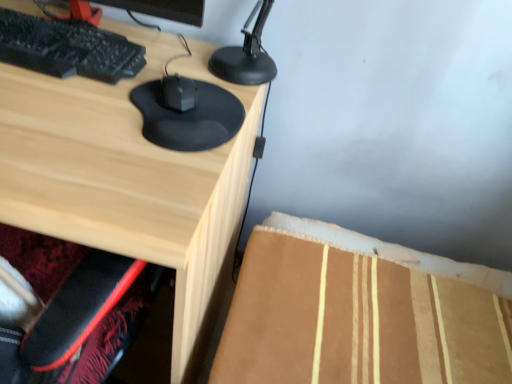
Question: Is matte wood desk at center not close to black matte mouse at center?

Choices:
 (A) yes
 (B) no

Answer: (B)

Question: Can you confirm if matte wood desk at center is smaller than black matte mouse at center?

Choices:
 (A) yes
 (B) no

Answer: (B)

Question: Is matte wood desk at center next to black matte mouse at center?

Choices:
 (A) yes
 (B) no

Answer: (B)

Question: Is matte wood desk at center aimed at black matte mouse at center?

Choices:
 (A) no
 (B) yes

Answer: (A)

Question: Does matte wood desk at center have a greater height compared to black matte mouse at center?

Choices:
 (A) no
 (B) yes

Answer: (B)

Question: Considering the relative sizes of matte wood desk at center and black matte mouse at center in the image provided, is matte wood desk at center thinner than black matte mouse at center?

Choices:
 (A) no
 (B) yes

Answer: (A)

Question: Is black matte mouse at center outside of matte wood desk at center?

Choices:
 (A) no
 (B) yes

Answer: (B)

Question: From the image's perspective, is black matte mouse at center above matte wood desk at center?

Choices:
 (A) yes
 (B) no

Answer: (A)

Question: Does black matte mouse at center lie in front of matte wood desk at center?

Choices:
 (A) yes
 (B) no

Answer: (B)

Question: Is matte wood desk at center at the back of black matte mouse at center?

Choices:
 (A) no
 (B) yes

Answer: (A)

Question: Can you confirm if black matte mouse at center is wider than matte wood desk at center?

Choices:
 (A) no
 (B) yes

Answer: (A)

Question: Considering the relative sizes of black matte mouse at center and matte wood desk at center in the image provided, is black matte mouse at center taller than matte wood desk at center?

Choices:
 (A) yes
 (B) no

Answer: (B)

Question: Is matte wood desk at center taller or shorter than black matte mouse at center?

Choices:
 (A) tall
 (B) short

Answer: (A)